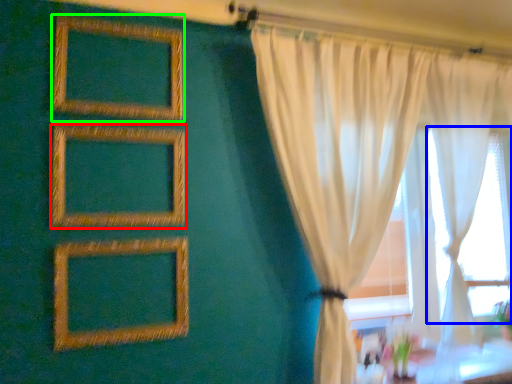
Question: Which is nearer to the picture frame (highlighted by a red box)? bay window (highlighted by a blue box) or picture frame (highlighted by a green box).

Choices:
 (A) bay window
 (B) picture frame

Answer: (B)